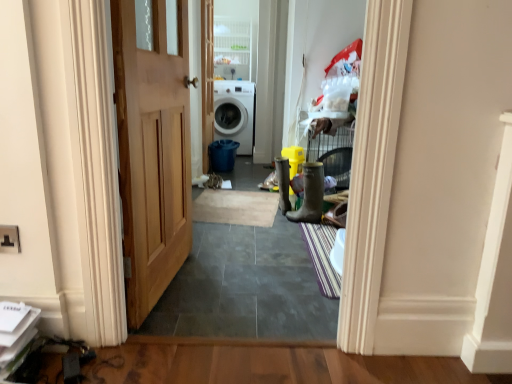
Where is `free point below rubber boot at center, the first boot in the back-to-front sequence (from a real-world perspective)`? This screenshot has width=512, height=384. free point below rubber boot at center, the first boot in the back-to-front sequence (from a real-world perspective) is located at coordinates (x=278, y=211).